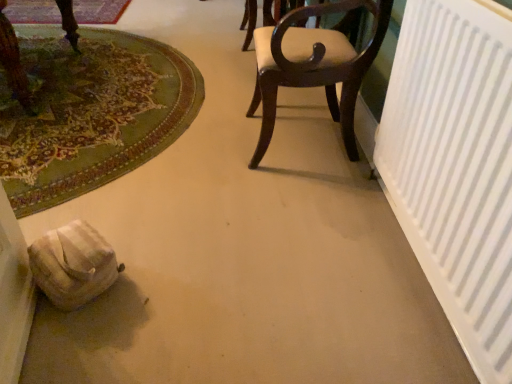
Question: Is dark wood chair at center located within carpeted mat at upper left, which is the second mat in bottom-to-top order?

Choices:
 (A) no
 (B) yes

Answer: (A)

Question: Can you confirm if carpeted mat at upper left, the second mat from the front, is positioned to the left of dark wood chair at center?

Choices:
 (A) yes
 (B) no

Answer: (A)

Question: Is carpeted mat at upper left, the first mat when ordered from top to bottom, closer to camera compared to dark wood chair at center?

Choices:
 (A) yes
 (B) no

Answer: (B)

Question: Is carpeted mat at upper left, the first mat when ordered from top to bottom, positioned behind dark wood chair at center?

Choices:
 (A) yes
 (B) no

Answer: (A)

Question: Does carpeted mat at upper left, the second mat from the front, have a smaller size compared to dark wood chair at center?

Choices:
 (A) yes
 (B) no

Answer: (A)

Question: Would you say carpeted mat at upper left, positioned as the 1th mat in back-to-front order, is to the left or to the right of white matte radiator at right in the picture?

Choices:
 (A) right
 (B) left

Answer: (B)

Question: Is carpeted mat at upper left, positioned as the 1th mat in back-to-front order, taller or shorter than white matte radiator at right?

Choices:
 (A) tall
 (B) short

Answer: (B)

Question: Is carpeted mat at upper left, positioned as the 1th mat in back-to-front order, inside the boundaries of white matte radiator at right, or outside?

Choices:
 (A) inside
 (B) outside

Answer: (B)

Question: Looking at their shapes, would you say carpeted mat at upper left, the second mat from the front, is wider or thinner than white matte radiator at right?

Choices:
 (A) thin
 (B) wide

Answer: (B)

Question: Looking at their shapes, would you say carpeted mat at upper left, the first mat when ordered from top to bottom, is wider or thinner than green carpet at lower left, the second mat from the top?

Choices:
 (A) wide
 (B) thin

Answer: (B)

Question: Considering the positions of carpeted mat at upper left, positioned as the 1th mat in back-to-front order, and green carpet at lower left, the second mat from the top, in the image, is carpeted mat at upper left, positioned as the 1th mat in back-to-front order, bigger or smaller than green carpet at lower left, the second mat from the top,?

Choices:
 (A) small
 (B) big

Answer: (A)

Question: Considering the positions of carpeted mat at upper left, which is the second mat in bottom-to-top order, and green carpet at lower left, the second mat from the top, in the image, is carpeted mat at upper left, which is the second mat in bottom-to-top order, taller or shorter than green carpet at lower left, the second mat from the top,?

Choices:
 (A) short
 (B) tall

Answer: (A)

Question: In the image, is carpeted mat at upper left, positioned as the 1th mat in back-to-front order, positioned in front of or behind green carpet at lower left, positioned as the 1th mat in bottom-to-top order?

Choices:
 (A) front
 (B) behind

Answer: (B)

Question: From their relative heights in the image, would you say dark wood chair at center is taller or shorter than green carpet at lower left, the second mat positioned from the back?

Choices:
 (A) short
 (B) tall

Answer: (B)

Question: Is dark wood chair at center bigger or smaller than green carpet at lower left, the second mat positioned from the back?

Choices:
 (A) small
 (B) big

Answer: (A)